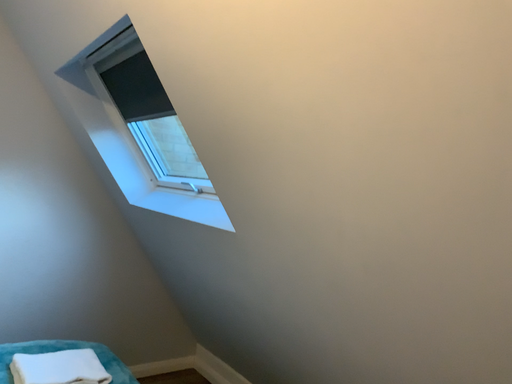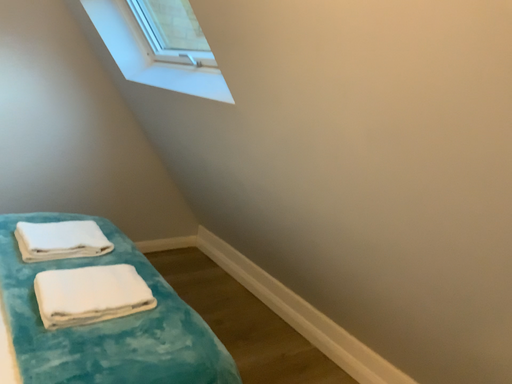
Question: How did the camera likely rotate when shooting the video?

Choices:
 (A) rotated downward
 (B) rotated upward

Answer: (A)